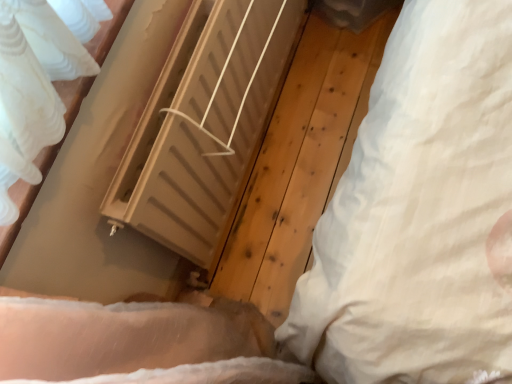
Question: Can you confirm if white soft pillow at right is positioned to the right of matte beige radiator at center?

Choices:
 (A) yes
 (B) no

Answer: (A)

Question: From the image's perspective, is white soft pillow at right below matte beige radiator at center?

Choices:
 (A) no
 (B) yes

Answer: (B)

Question: Is white soft pillow at right not within matte beige radiator at center?

Choices:
 (A) no
 (B) yes

Answer: (B)

Question: Does white soft pillow at right contain matte beige radiator at center?

Choices:
 (A) yes
 (B) no

Answer: (B)

Question: From a real-world perspective, is white soft pillow at right located beneath matte beige radiator at center?

Choices:
 (A) no
 (B) yes

Answer: (A)

Question: Is white soft pillow at right not close to matte beige radiator at center?

Choices:
 (A) no
 (B) yes

Answer: (A)

Question: Is matte beige radiator at center outside of white soft pillow at right?

Choices:
 (A) yes
 (B) no

Answer: (A)

Question: From a real-world perspective, is matte beige radiator at center located higher than white soft pillow at right?

Choices:
 (A) yes
 (B) no

Answer: (B)

Question: From the image's perspective, is matte beige radiator at center beneath white soft pillow at right?

Choices:
 (A) yes
 (B) no

Answer: (B)

Question: Considering the relative sizes of matte beige radiator at center and white soft pillow at right in the image provided, is matte beige radiator at center taller than white soft pillow at right?

Choices:
 (A) no
 (B) yes

Answer: (A)

Question: Could you tell me if matte beige radiator at center is turned towards white soft pillow at right?

Choices:
 (A) yes
 (B) no

Answer: (A)

Question: From a real-world perspective, is matte beige radiator at center located beneath white soft pillow at right?

Choices:
 (A) no
 (B) yes

Answer: (B)

Question: From their relative heights in the image, would you say matte beige radiator at center is taller or shorter than white soft pillow at right?

Choices:
 (A) short
 (B) tall

Answer: (A)